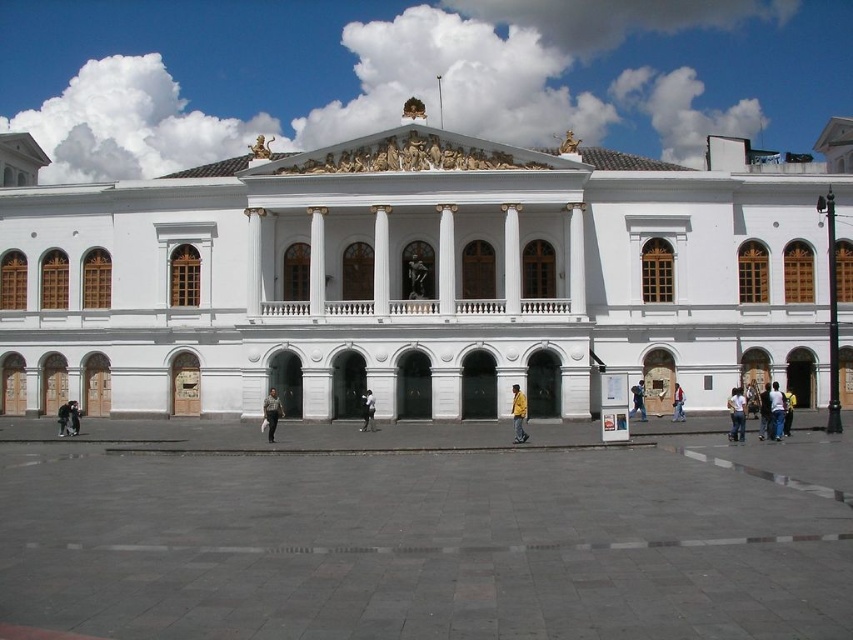
Who is higher up, light blue jeans at lower right or dark gray jacket at lower left?

Positioned higher is light blue jeans at lower right.

Does point (770, 397) lie in front of point (73, 404)?

Yes, it is.

Is point (782, 416) behind point (74, 429)?

That is False.

Identify the location of light blue jeans at lower right. [776, 410].

The image size is (853, 640). I want to click on yellow matte jacket at center, so click(x=518, y=413).

The width and height of the screenshot is (853, 640). Describe the element at coordinates (518, 413) in the screenshot. I see `yellow matte jacket at center` at that location.

What do you see at coordinates (518, 413) in the screenshot? The height and width of the screenshot is (640, 853). I see `yellow matte jacket at center` at bounding box center [518, 413].

Where is `yellow matte jacket at center`? This screenshot has width=853, height=640. yellow matte jacket at center is located at coordinates (518, 413).

Is yellow matte jacket at center positioned behind dark blue jeans at center?

No, yellow matte jacket at center is in front of dark blue jeans at center.

Between point (515, 413) and point (372, 412), which one is positioned behind?

Point (372, 412)

In order to click on yellow matte jacket at center in this screenshot , I will do `click(518, 413)`.